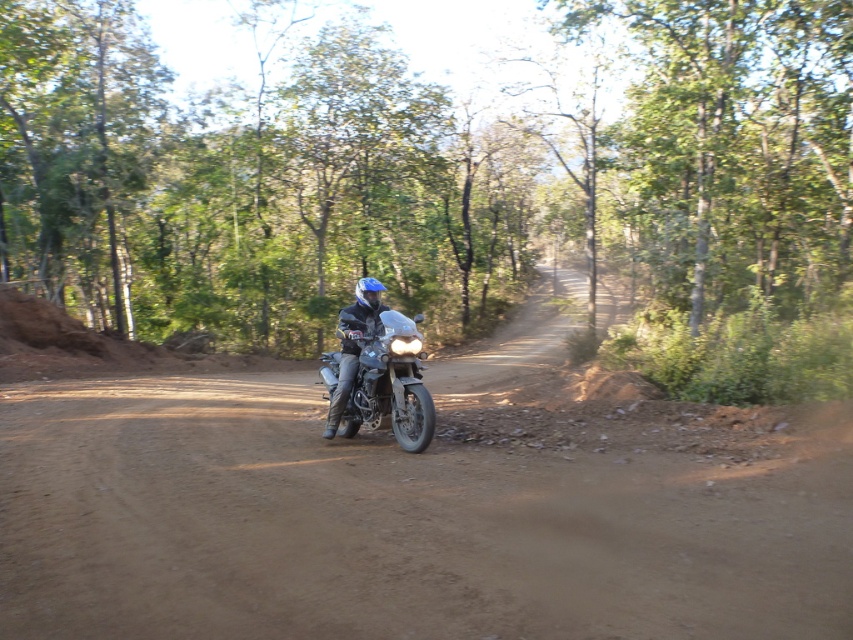
You are a photographer planning to take a photo of both the metallic silver motorcycle at center and the matte black motorcycle at center. The camera you have can only capture objects within a 1.5 meter width. Which motorcycle should you choose to ensure it fits entirely within the camera frame?

The matte black motorcycle at center has a smaller width compared to the metallic silver motorcycle at center. Since the camera can only capture up to 1.5 meters, the matte black motorcycle at center is more likely to fit within the frame.

You are a hiker trying to navigate through the dense greenery. You notice a green leafy tree at center and green leafy trees at upper center. Which of these would be better to use as a landmark for navigation?

The green leafy tree at center would be better to use as a landmark for navigation because it is larger in size than the green leafy trees at upper center, making it more distinct and easier to identify from a distance.

You are a photographer positioned at the start of the dirt road. You want to capture both the metallic silver motorcycle at center and the matte black motorcycle at center in a single frame. Which motorcycle should you move closer to in order to include both in your photo?

The metallic silver motorcycle at center is in front of the matte black motorcycle at center. To include both in the photo, you should move closer to the matte black motorcycle at center so that you can capture both the foreground and background motorcycles within the frame.